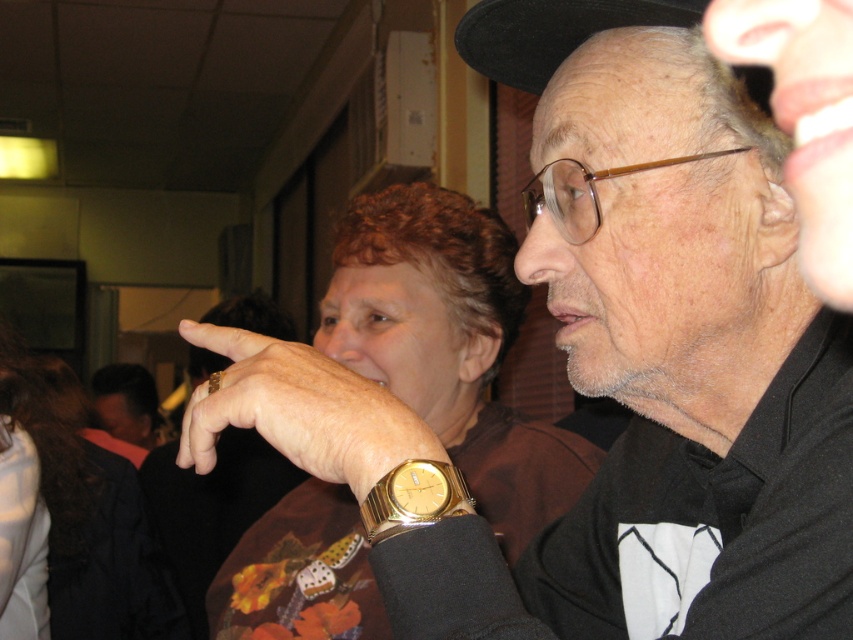
You are organizing a charity event and need to ensure that all items displayed are correctly labeled. You have a brown fabric shirt at center and a gold metallic watch at center. Which item should you label as the larger one?

The brown fabric shirt at center is bigger than the gold metallic watch at center, so you should label the brown fabric shirt at center as the larger item.

You are a jeweler inspecting two gold metallic watches in an image. You see the gold metallic watch at center and the gold metallic watch at lower center. Which one appears bigger in size?

The gold metallic watch at center appears bigger in size compared to the gold metallic watch at lower center.

You are at the coordinates 0.5, 0.5 in the image. You want to move to the brown fabric shirt at center. Which direction should you move in?

The brown fabric shirt at center is located at point (450, 346). Since you are at (426, 320), you should move northeast to reach it.